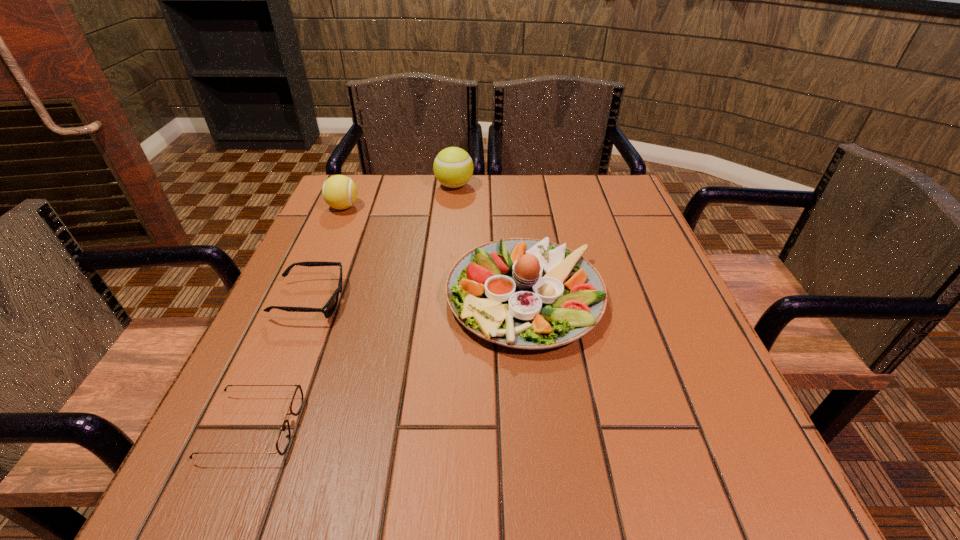
You are a GUI agent. You are given a task and a screenshot of the screen. Output one action in this format:
    pyautogui.click(x=<x>, y=<y>)
    Task: Click on the free space between the fourth nearest object and the farther sunglasses
    The height and width of the screenshot is (540, 960).
    Given the screenshot: What is the action you would take?
    pyautogui.click(x=326, y=254)

Identify the location of empty space that is in between the third tallest object and the taller tennis ball. (398, 197).

Where is `vacant area between the left tennis ball and the farther sunglasses`? The height and width of the screenshot is (540, 960). vacant area between the left tennis ball and the farther sunglasses is located at coordinates (x=326, y=254).

Locate an element on the screen. This screenshot has height=540, width=960. vacant space that is in between the nearest object and the salad plate is located at coordinates (389, 362).

Identify which object is the fourth nearest to the left tennis ball. Please provide its 2D coordinates. Your answer should be formatted as a tuple, i.e. [(x, y)], where the tuple contains the x and y coordinates of a point satisfying the conditions above.

[(283, 439)]

Identify which object is the third closest to the nearer sunglasses. Please provide its 2D coordinates. Your answer should be formatted as a tuple, i.e. [(x, y)], where the tuple contains the x and y coordinates of a point satisfying the conditions above.

[(340, 192)]

Locate an element on the screen. The image size is (960, 540). vacant space that satisfies the following two spatial constraints: 1. on the front side of the salad plate; 2. on the front-facing side of the shortest object is located at coordinates (540, 427).

You are a GUI agent. You are given a task and a screenshot of the screen. Output one action in this format:
    pyautogui.click(x=<x>, y=<y>)
    Task: Click on the vacant region that satisfies the following two spatial constraints: 1. on the front side of the right tennis ball; 2. on the front-facing side of the shorter sunglasses
    This screenshot has width=960, height=540.
    Given the screenshot: What is the action you would take?
    pyautogui.click(x=433, y=427)

Where is `free spot that satisfies the following two spatial constraints: 1. on the front side of the salad plate; 2. on the front-facing side of the nearest object`? free spot that satisfies the following two spatial constraints: 1. on the front side of the salad plate; 2. on the front-facing side of the nearest object is located at coordinates (540, 427).

Identify the location of free region that satisfies the following two spatial constraints: 1. on the front side of the salad plate; 2. on the front-facing side of the farther sunglasses. (525, 300).